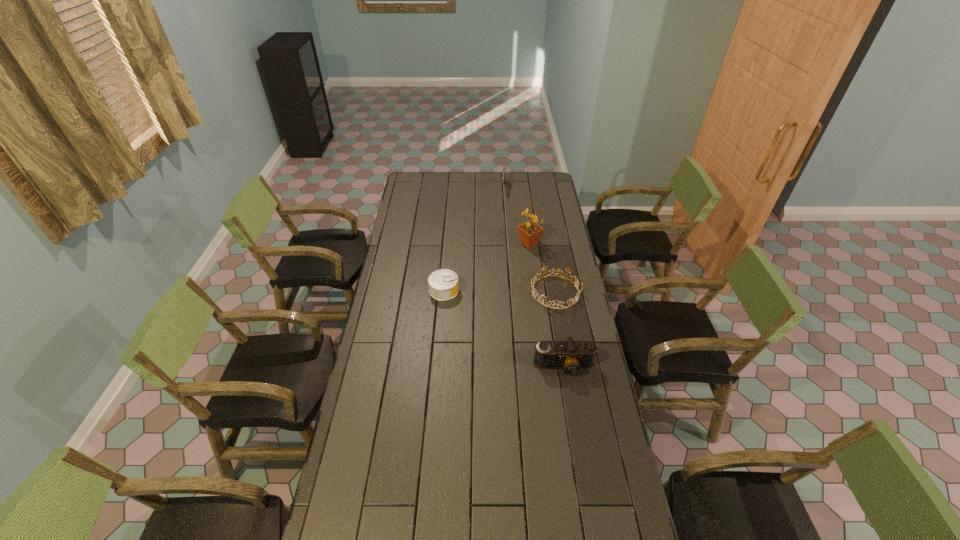
This screenshot has height=540, width=960. I want to click on vacant area that lies between the leftmost object and the sunflower, so click(487, 267).

Find the location of a particular element. This screenshot has height=540, width=960. free space between the tiara and the tallest object is located at coordinates (542, 267).

I want to click on vacant space in between the farthest object and the nearest object, so click(x=534, y=277).

Locate an element on the screen. The image size is (960, 540). free spot between the camera and the tallest object is located at coordinates (546, 305).

Identify which object is located as the nearest to the leftmost object. Please provide its 2D coordinates. Your answer should be formatted as a tuple, i.e. [(x, y)], where the tuple contains the x and y coordinates of a point satisfying the conditions above.

[(534, 294)]

At what (x,y) coordinates should I click in order to perform the action: click on the second closest object to the pistol. Please return your answer as a coordinate pair (x, y). This screenshot has width=960, height=540. Looking at the image, I should click on (534, 294).

Where is `free space that satisfies the following two spatial constraints: 1. on the back side of the can; 2. on the left side of the pistol`? The image size is (960, 540). free space that satisfies the following two spatial constraints: 1. on the back side of the can; 2. on the left side of the pistol is located at coordinates (452, 188).

You are a GUI agent. You are given a task and a screenshot of the screen. Output one action in this format:
    pyautogui.click(x=<x>, y=<y>)
    Task: Click on the vacant space that satisfies the following two spatial constraints: 1. on the front side of the tiara; 2. on the left side of the farthest object
    The height and width of the screenshot is (540, 960).
    Given the screenshot: What is the action you would take?
    pyautogui.click(x=511, y=292)